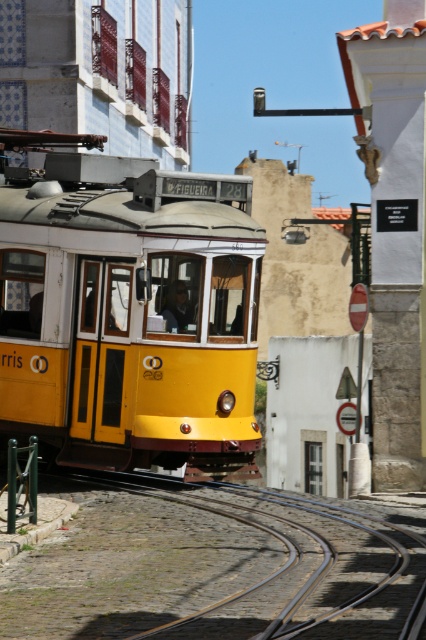
Which is behind, point (183, 300) or point (77, 628)?

The point (183, 300) is behind.

Is point (138, 240) more distant than point (83, 620)?

Yes, it is behind point (83, 620).

Find the location of `yellow matte train at center`. yellow matte train at center is located at coordinates (131, 314).

This screenshot has width=426, height=640. I want to click on yellow matte train at center, so click(131, 314).